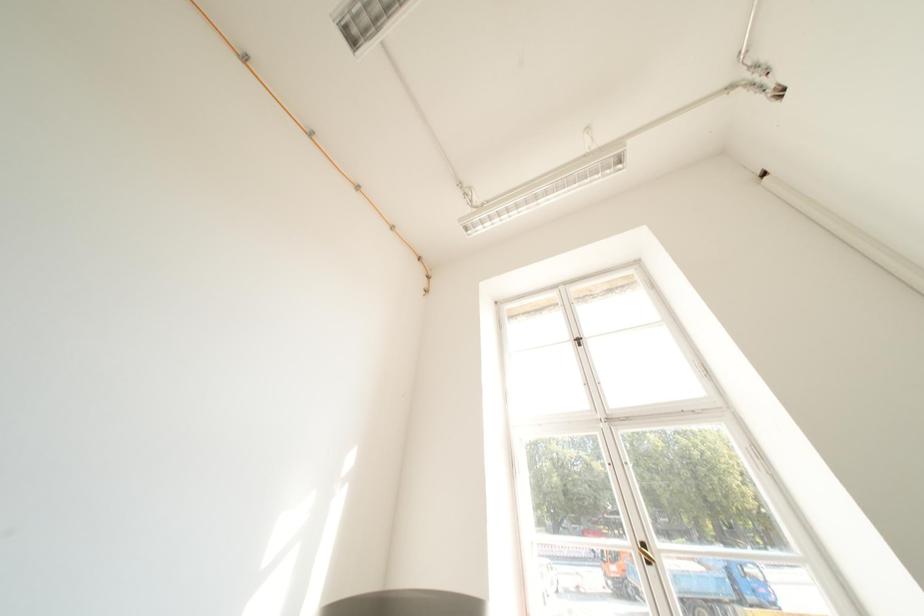
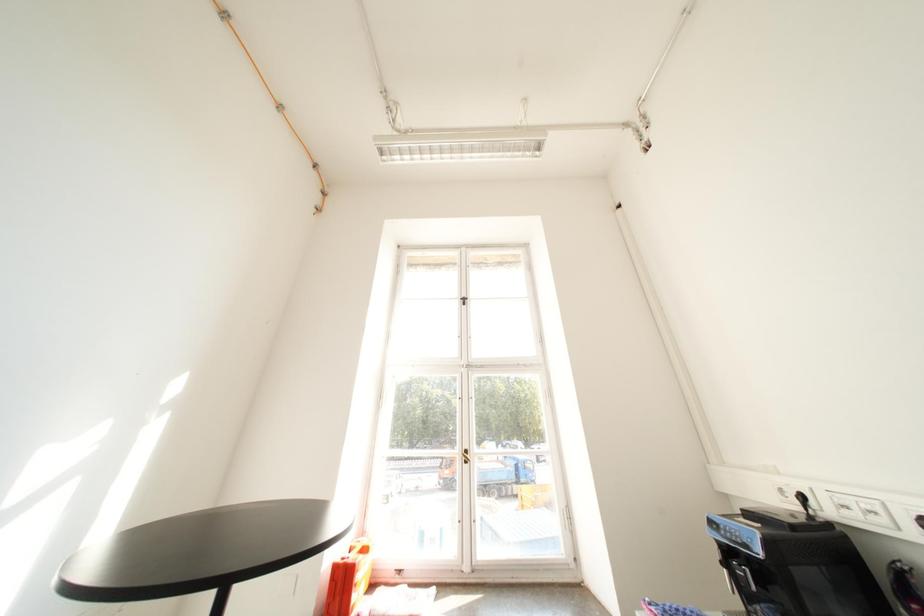
The images are taken continuously from a first-person perspective. In which direction are you moving?

The cameraman moved toward right, backward.